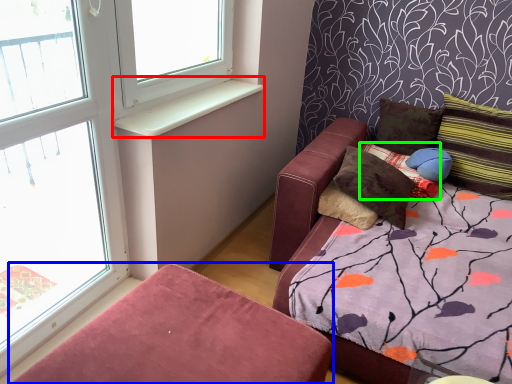
Question: Based on their relative distances, which object is farther from window sill (highlighted by a red box)? Choose from furniture (highlighted by a blue box) and pillow (highlighted by a green box).

Choices:
 (A) furniture
 (B) pillow

Answer: (B)